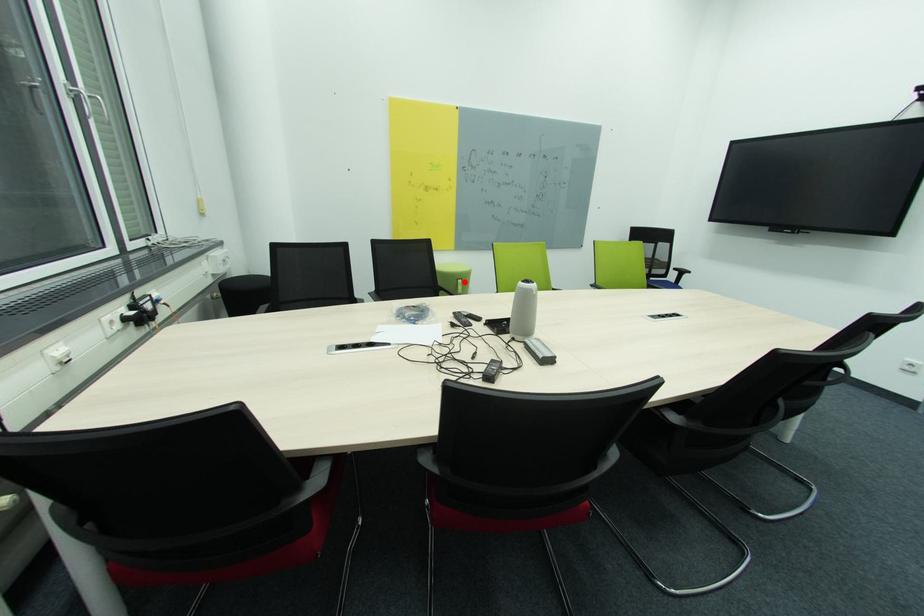
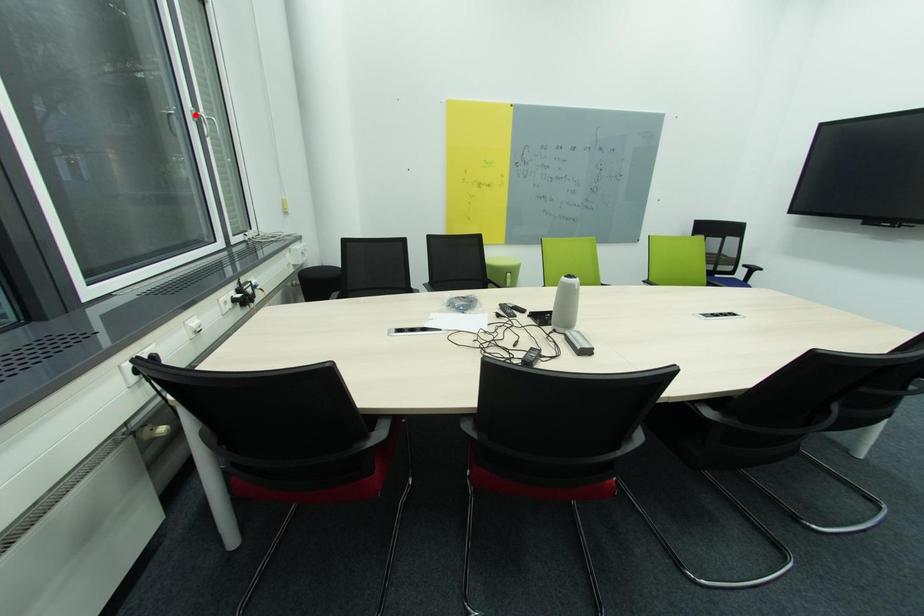
I am providing you with two images of the same scene from different viewpoints. A red point is marked on the first image and another point is marked on the second image. Are the points marked in image1 and image2 representing the same 3D position?

No